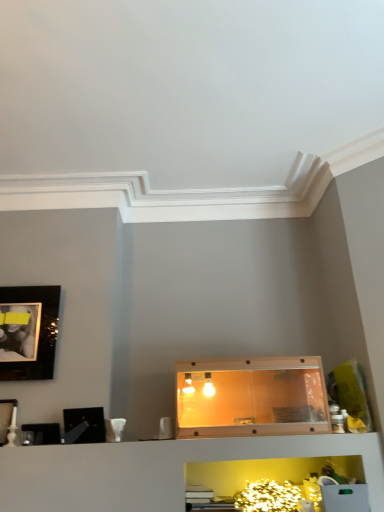
Question: Considering their positions, is matte black picture frame at upper left, marked as the 4th picture frame in a bottom-to-top arrangement, located in front of or behind black glossy picture frame at left, the second picture frame from the top?

Choices:
 (A) behind
 (B) front

Answer: (A)

Question: In terms of size, does matte black picture frame at upper left, positioned as the 1th picture frame in top-to-bottom order, appear bigger or smaller than black glossy picture frame at left, the second picture frame from the top?

Choices:
 (A) small
 (B) big

Answer: (B)

Question: Considering the real-world distances, which object is farthest from the matte black picture frame at lower left, marked as the 1th picture frame in a bottom-to-top arrangement?

Choices:
 (A) matte black picture frame at left, placed as the 2th picture frame when sorted from bottom to top
 (B) black glossy picture frame at left, marked as the third picture frame in a bottom-to-top arrangement
 (C) matte black picture frame at upper left, marked as the 4th picture frame in a bottom-to-top arrangement
 (D) translucent plastic cabinet at center

Answer: (D)

Question: Which object is the closest to the matte black picture frame at lower left, the 4th picture frame when ordered from top to bottom?

Choices:
 (A) matte black picture frame at left, which is counted as the 3th picture frame, starting from the top
 (B) matte black picture frame at upper left, marked as the 4th picture frame in a bottom-to-top arrangement
 (C) black glossy picture frame at left, marked as the third picture frame in a bottom-to-top arrangement
 (D) translucent plastic cabinet at center

Answer: (A)